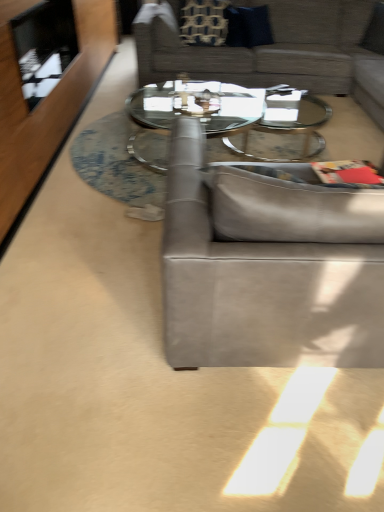
What do you see at coordinates (203, 22) in the screenshot? The height and width of the screenshot is (512, 384). I see `patterned fabric pillow at upper center, arranged as the first pillow when viewed from the left` at bounding box center [203, 22].

In order to face patterned fabric pillow at upper center, arranged as the first pillow when viewed from the left, should I rotate leftwards or rightwards?

To face it directly, rotate right by 1.739 degrees.

At what (x,y) coordinates should I click in order to perform the action: click on dark blue fabric pillow at upper center, placed as the first pillow when sorted from right to left. Please return your answer as a coordinate pair (x, y). This screenshot has width=384, height=512. Looking at the image, I should click on (248, 26).

At what (x,y) coordinates should I click in order to perform the action: click on patterned fabric pillow at upper center, marked as the second pillow in a right-to-left arrangement. Please return your answer as a coordinate pair (x, y). Looking at the image, I should click on (203, 22).

From the picture: Is suede gray couch at center, placed as the 1th studio couch when sorted from bottom to top, inside or outside of textured gray couch at upper center, acting as the first studio couch starting from the back?

suede gray couch at center, placed as the 1th studio couch when sorted from bottom to top, is spatially situated outside textured gray couch at upper center, acting as the first studio couch starting from the back.

From a real-world perspective, is suede gray couch at center, which is the 1th studio couch in front-to-back order, positioned over textured gray couch at upper center, marked as the first studio couch in a top-to-bottom arrangement, based on gravity?

No.

Find the location of a particular element. This screenshot has width=384, height=512. studio couch on the right of suede gray couch at center, placed as the 1th studio couch when sorted from bottom to top is located at coordinates (267, 49).

From the image's perspective, is suede gray couch at center, the 2th studio couch positioned from the top, above or below textured gray couch at upper center, acting as the first studio couch starting from the back?

Based on their image positions, suede gray couch at center, the 2th studio couch positioned from the top, is located beneath textured gray couch at upper center, acting as the first studio couch starting from the back.

Which object is more forward, dark blue fabric pillow at upper center, placed as the first pillow when sorted from right to left, or textured gray couch at upper center, which is the second studio couch in front-to-back order?

textured gray couch at upper center, which is the second studio couch in front-to-back order, is more forward.

From a real-world perspective, starting from the textured gray couch at upper center, the second studio couch ordered from the bottom, which pillow is the 1st one vertically above it? Please provide its 2D coordinates.

[(248, 26)]

Is dark blue fabric pillow at upper center, the second pillow from the left, oriented away from textured gray couch at upper center, marked as the first studio couch in a top-to-bottom arrangement?

Yes, dark blue fabric pillow at upper center, the second pillow from the left, is facing away from textured gray couch at upper center, marked as the first studio couch in a top-to-bottom arrangement.

Between dark blue fabric pillow at upper center, placed as the first pillow when sorted from right to left, and textured gray couch at upper center, marked as the first studio couch in a top-to-bottom arrangement, which one has larger size?

textured gray couch at upper center, marked as the first studio couch in a top-to-bottom arrangement.

Are patterned fabric pillow at upper center, marked as the second pillow in a right-to-left arrangement, and clear glass coffee table at center beside each other?

They are not placed beside each other.

Is patterned fabric pillow at upper center, arranged as the first pillow when viewed from the left, outside of clear glass coffee table at center?

Yes.

Would you say patterned fabric pillow at upper center, marked as the second pillow in a right-to-left arrangement, is to the left or to the right of clear glass coffee table at center in the picture?

patterned fabric pillow at upper center, marked as the second pillow in a right-to-left arrangement, is positioned on clear glass coffee table at center's left side.

The width and height of the screenshot is (384, 512). Identify the location of pillow that is the 2nd object located behind the textured gray couch at upper center, the second studio couch ordered from the bottom. (203, 22).

Is textured gray couch at upper center, marked as the first studio couch in a top-to-bottom arrangement, beside patterned fabric pillow at upper center, arranged as the first pillow when viewed from the left?

They are not placed beside each other.

Between textured gray couch at upper center, marked as the first studio couch in a top-to-bottom arrangement, and patterned fabric pillow at upper center, marked as the second pillow in a right-to-left arrangement, which one has less height?

Standing shorter between the two is patterned fabric pillow at upper center, marked as the second pillow in a right-to-left arrangement.

Who is smaller, textured gray couch at upper center, the second studio couch ordered from the bottom, or patterned fabric pillow at upper center, arranged as the first pillow when viewed from the left?

patterned fabric pillow at upper center, arranged as the first pillow when viewed from the left, is smaller.

Does point (255, 322) lie in front of point (137, 154)?

That is True.

Between suede gray couch at center, placed as the 1th studio couch when sorted from bottom to top, and clear glass coffee table at center, which one has larger size?

Bigger between the two is suede gray couch at center, placed as the 1th studio couch when sorted from bottom to top.

This screenshot has width=384, height=512. Identify the location of coffee table above the suede gray couch at center, which is the 1th studio couch in front-to-back order (from the image's perspective). (227, 119).

From a real-world perspective, which is physically below, suede gray couch at center, the 2th studio couch positioned from the top, or clear glass coffee table at center?

From a 3D spatial view, clear glass coffee table at center is below.

Does suede gray couch at center, the 2th studio couch positioned from the top, come in front of dark blue fabric pillow at upper center, placed as the first pillow when sorted from right to left?

Yes, suede gray couch at center, the 2th studio couch positioned from the top, is closer to the camera.

Who is shorter, suede gray couch at center, which is the 1th studio couch in front-to-back order, or dark blue fabric pillow at upper center, placed as the first pillow when sorted from right to left?

Standing shorter between the two is dark blue fabric pillow at upper center, placed as the first pillow when sorted from right to left.

Could you tell me if suede gray couch at center, placed as the 1th studio couch when sorted from bottom to top, is facing dark blue fabric pillow at upper center, placed as the first pillow when sorted from right to left?

Yes, suede gray couch at center, placed as the 1th studio couch when sorted from bottom to top, is aimed at dark blue fabric pillow at upper center, placed as the first pillow when sorted from right to left.

You are a GUI agent. You are given a task and a screenshot of the screen. Output one action in this format:
    pyautogui.click(x=<x>, y=<y>)
    Task: Click on the 2nd studio couch below the dark blue fabric pillow at upper center, placed as the first pillow when sorted from right to left (from a real-world perspective)
    This screenshot has width=384, height=512.
    Given the screenshot: What is the action you would take?
    pyautogui.click(x=259, y=283)

Is clear glass coffee table at center closer to the viewer compared to dark blue fabric pillow at upper center, placed as the first pillow when sorted from right to left?

Yes, it is in front of dark blue fabric pillow at upper center, placed as the first pillow when sorted from right to left.

Which is more to the right, clear glass coffee table at center or dark blue fabric pillow at upper center, the second pillow from the left?

From the viewer's perspective, dark blue fabric pillow at upper center, the second pillow from the left, appears more on the right side.

Considering the sizes of clear glass coffee table at center and dark blue fabric pillow at upper center, the second pillow from the left, in the image, is clear glass coffee table at center taller or shorter than dark blue fabric pillow at upper center, the second pillow from the left,?

Considering their sizes, clear glass coffee table at center has less height than dark blue fabric pillow at upper center, the second pillow from the left.

How different are the orientations of clear glass coffee table at center and dark blue fabric pillow at upper center, the second pillow from the left, in degrees?

126 degrees.

At what (x,y) coordinates should I click in order to perform the action: click on studio couch on the left of the textured gray couch at upper center, marked as the first studio couch in a top-to-bottom arrangement. Please return your answer as a coordinate pair (x, y). Looking at the image, I should click on (259, 283).

Starting from the textured gray couch at upper center, marked as the first studio couch in a top-to-bottom arrangement, which pillow is the 1st one behind? Please provide its 2D coordinates.

[(248, 26)]

Considering their positions, is suede gray couch at center, which is the 2th studio couch from back to front, positioned closer to textured gray couch at upper center, acting as the first studio couch starting from the back, than clear glass coffee table at center?

Based on the image, clear glass coffee table at center appears to be nearer to textured gray couch at upper center, acting as the first studio couch starting from the back.

Considering their positions, is patterned fabric pillow at upper center, arranged as the first pillow when viewed from the left, positioned closer to clear glass coffee table at center than textured gray couch at upper center, which is the second studio couch in front-to-back order?

Among the two, textured gray couch at upper center, which is the second studio couch in front-to-back order, is located nearer to clear glass coffee table at center.

Estimate the real-world distances between objects in this image. Which object is further from clear glass coffee table at center, patterned fabric pillow at upper center, marked as the second pillow in a right-to-left arrangement, or suede gray couch at center, the 2th studio couch positioned from the top?

The object further to clear glass coffee table at center is suede gray couch at center, the 2th studio couch positioned from the top.

When comparing their distances from patterned fabric pillow at upper center, arranged as the first pillow when viewed from the left, does suede gray couch at center, which is the 2th studio couch from back to front, or dark blue fabric pillow at upper center, the second pillow from the left, seem closer?

Based on the image, dark blue fabric pillow at upper center, the second pillow from the left, appears to be nearer to patterned fabric pillow at upper center, arranged as the first pillow when viewed from the left.

Looking at the image, which one is located further to dark blue fabric pillow at upper center, placed as the first pillow when sorted from right to left, clear glass coffee table at center or patterned fabric pillow at upper center, marked as the second pillow in a right-to-left arrangement?

Among the two, clear glass coffee table at center is located further to dark blue fabric pillow at upper center, placed as the first pillow when sorted from right to left.

Looking at the image, which one is located closer to textured gray couch at upper center, acting as the first studio couch starting from the back, clear glass coffee table at center or patterned fabric pillow at upper center, marked as the second pillow in a right-to-left arrangement?

patterned fabric pillow at upper center, marked as the second pillow in a right-to-left arrangement, lies closer to textured gray couch at upper center, acting as the first studio couch starting from the back, than the other object.

Looking at the image, which one is located further to dark blue fabric pillow at upper center, the second pillow from the left, suede gray couch at center, the 2th studio couch positioned from the top, or clear glass coffee table at center?

suede gray couch at center, the 2th studio couch positioned from the top, lies further to dark blue fabric pillow at upper center, the second pillow from the left, than the other object.

Considering their positions, is suede gray couch at center, placed as the 1th studio couch when sorted from bottom to top, positioned further to clear glass coffee table at center than patterned fabric pillow at upper center, marked as the second pillow in a right-to-left arrangement?

suede gray couch at center, placed as the 1th studio couch when sorted from bottom to top, is further to clear glass coffee table at center.

This screenshot has height=512, width=384. What are the coordinates of `studio couch between dark blue fabric pillow at upper center, the second pillow from the left, and clear glass coffee table at center, in the vertical direction` in the screenshot? It's located at (267, 49).

Locate an element on the screen. This screenshot has height=512, width=384. coffee table between suede gray couch at center, placed as the 1th studio couch when sorted from bottom to top, and textured gray couch at upper center, the second studio couch ordered from the bottom, along the z-axis is located at coordinates (227, 119).

Where is `pillow between patterned fabric pillow at upper center, arranged as the first pillow when viewed from the left, and textured gray couch at upper center, the second studio couch ordered from the bottom, in the horizontal direction`? Image resolution: width=384 pixels, height=512 pixels. pillow between patterned fabric pillow at upper center, arranged as the first pillow when viewed from the left, and textured gray couch at upper center, the second studio couch ordered from the bottom, in the horizontal direction is located at coordinates (248, 26).

Find the location of a particular element. The width and height of the screenshot is (384, 512). studio couch located between suede gray couch at center, placed as the 1th studio couch when sorted from bottom to top, and dark blue fabric pillow at upper center, placed as the first pillow when sorted from right to left, in the depth direction is located at coordinates click(x=267, y=49).